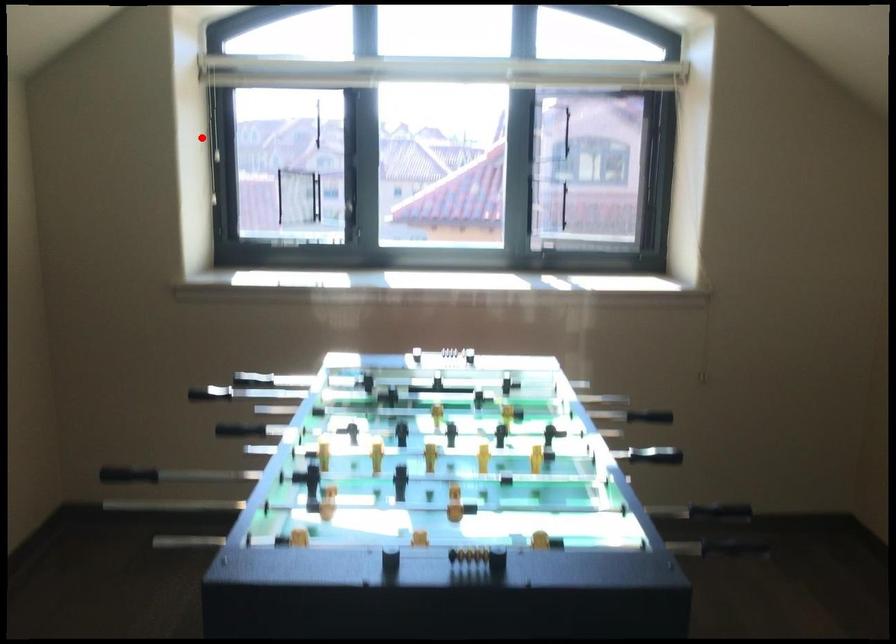
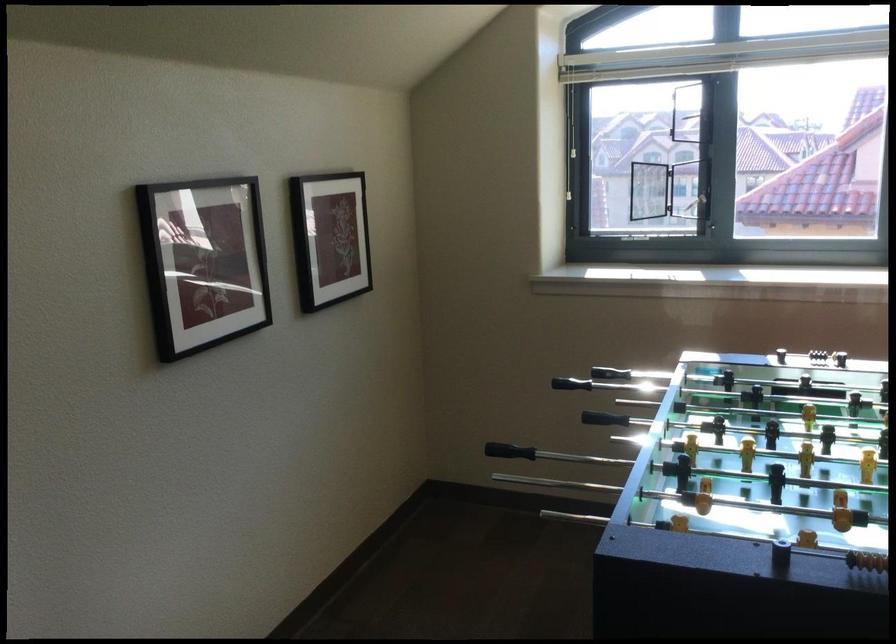
Locate, in the second image, the point that corresponds to the highlighted location in the first image.

(567, 138)